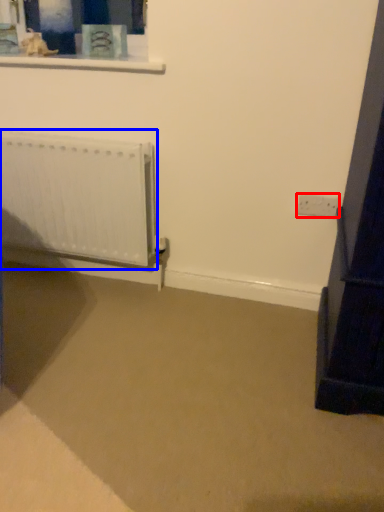
Question: Which object is further to the camera taking this photo, electric outlet (highlighted by a red box) or radiator (highlighted by a blue box)?

Choices:
 (A) electric outlet
 (B) radiator

Answer: (A)